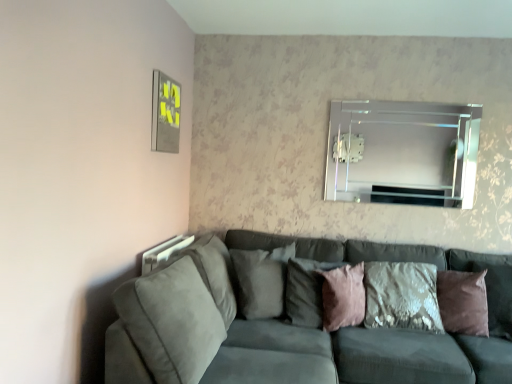
Question: Can you confirm if pink velvet pillow at center, which appears as the second pillow when viewed from the right, is thinner than suede gray pillow at center, the first pillow viewed from the left?

Choices:
 (A) yes
 (B) no

Answer: (A)

Question: Is pink velvet pillow at center, marked as the third pillow in a left-to-right arrangement, to the left of suede gray pillow at center, the fourth pillow positioned from the right, from the viewer's perspective?

Choices:
 (A) no
 (B) yes

Answer: (A)

Question: Is pink velvet pillow at center, which appears as the second pillow when viewed from the right, located outside suede gray pillow at center, the fourth pillow positioned from the right?

Choices:
 (A) yes
 (B) no

Answer: (A)

Question: Is pink velvet pillow at center, which appears as the second pillow when viewed from the right, positioned with its back to suede gray pillow at center, the first pillow viewed from the left?

Choices:
 (A) yes
 (B) no

Answer: (A)

Question: Is pink velvet pillow at center, marked as the third pillow in a left-to-right arrangement, to the right of suede gray pillow at center, the fourth pillow positioned from the right, from the viewer's perspective?

Choices:
 (A) no
 (B) yes

Answer: (B)

Question: Does point (258, 317) appear closer or farther from the camera than point (288, 294)?

Choices:
 (A) closer
 (B) farther

Answer: (A)

Question: Considering their positions, is suede gray pillow at center, the first pillow viewed from the left, located in front of or behind pink velvet pillow at center, the 3th pillow viewed from the right?

Choices:
 (A) behind
 (B) front

Answer: (A)

Question: Based on their positions, is suede gray pillow at center, the fourth pillow positioned from the right, located to the left or right of pink velvet pillow at center, the 3th pillow viewed from the right?

Choices:
 (A) left
 (B) right

Answer: (A)

Question: In terms of width, does suede gray pillow at center, the first pillow viewed from the left, look wider or thinner when compared to pink velvet pillow at center, the second pillow in the left-to-right sequence?

Choices:
 (A) wide
 (B) thin

Answer: (A)

Question: From the image's perspective, is suede gray couch at lower left above or below clear glass mirror at upper center?

Choices:
 (A) below
 (B) above

Answer: (A)

Question: In the image, is suede gray couch at lower left positioned in front of or behind clear glass mirror at upper center?

Choices:
 (A) front
 (B) behind

Answer: (A)

Question: Considering the positions of suede gray couch at lower left and clear glass mirror at upper center in the image, is suede gray couch at lower left wider or thinner than clear glass mirror at upper center?

Choices:
 (A) thin
 (B) wide

Answer: (B)

Question: Based on their positions, is suede gray couch at lower left located to the left or right of clear glass mirror at upper center?

Choices:
 (A) left
 (B) right

Answer: (A)

Question: Is point (302, 291) positioned closer to the camera than point (418, 165)?

Choices:
 (A) farther
 (B) closer

Answer: (B)

Question: Considering the positions of pink velvet pillow at center, the 3th pillow viewed from the right, and clear glass mirror at upper center in the image, is pink velvet pillow at center, the 3th pillow viewed from the right, taller or shorter than clear glass mirror at upper center?

Choices:
 (A) tall
 (B) short

Answer: (B)